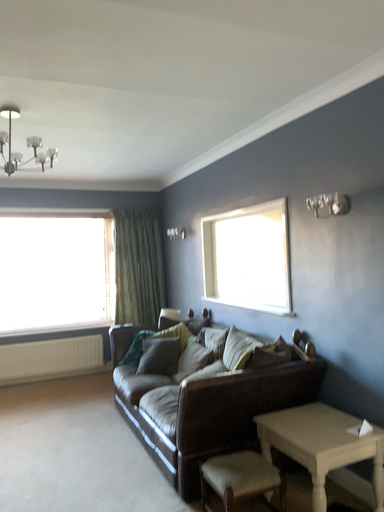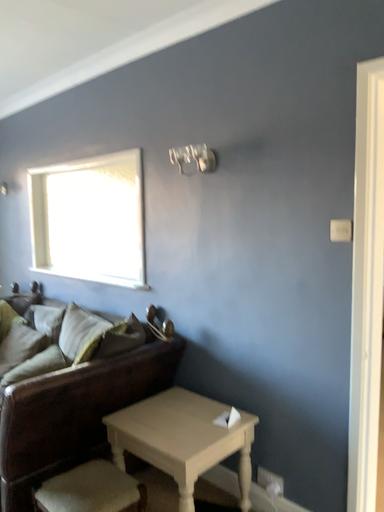
Question: How did the camera likely rotate when shooting the video?

Choices:
 (A) rotated left
 (B) rotated right

Answer: (B)